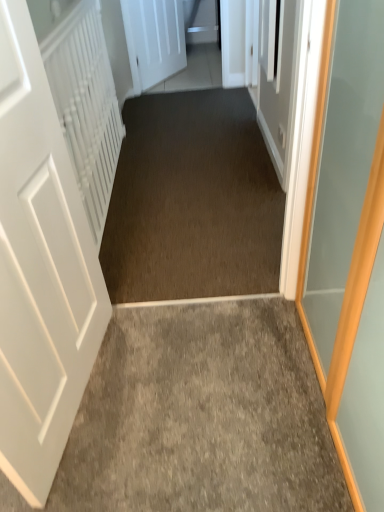
Locate an element on the screen. The width and height of the screenshot is (384, 512). white matte door at left, the first door from the front is located at coordinates (38, 270).

You are a GUI agent. You are given a task and a screenshot of the screen. Output one action in this format:
    pyautogui.click(x=<x>, y=<y>)
    Task: Click on the gray carpet at center
    
    Given the screenshot: What is the action you would take?
    pyautogui.click(x=202, y=416)

Considering the relative positions of white textured radiator at left and dark brown carpet at center in the image provided, is white textured radiator at left in front of dark brown carpet at center?

Yes, the depth of white textured radiator at left is less than that of dark brown carpet at center.

Is white textured radiator at left next to dark brown carpet at center and touching it?

No, white textured radiator at left is not beside dark brown carpet at center.

In order to click on corridor below the white textured radiator at left (from a real-world perspective) in this screenshot , I will do `click(192, 201)`.

Is white textured radiator at left wider or thinner than dark brown carpet at center?

Clearly, white textured radiator at left has less width compared to dark brown carpet at center.

From a real-world perspective, which is physically below, white matte door at left, the second door positioned from the back, or white matte door at upper center, which is the first door in back-to-front order?

white matte door at upper center, which is the first door in back-to-front order, from a real-world perspective.

Would you say white matte door at upper center, acting as the 2th door starting from the bottom, is part of white matte door at left, the 1th door in the bottom-to-top sequence,'s contents?

No, white matte door at upper center, acting as the 2th door starting from the bottom, is located outside of white matte door at left, the 1th door in the bottom-to-top sequence.

Identify the location of door below the white matte door at left, the second door positioned from the back (from a real-world perspective). This screenshot has height=512, width=384. (154, 40).

Which object is further away from the camera taking this photo, white matte door at left, the 1th door in the bottom-to-top sequence, or white matte door at upper center, acting as the 1th door starting from the top?

white matte door at upper center, acting as the 1th door starting from the top, is more distant.

This screenshot has height=512, width=384. In the image, there is a gray carpet at center. Identify the location of radiator above it (from the image's perspective). (86, 105).

From the image's perspective, would you say gray carpet at center is shown under white textured radiator at left?

Yes.

Considering the relative sizes of gray carpet at center and white textured radiator at left in the image provided, is gray carpet at center thinner than white textured radiator at left?

In fact, gray carpet at center might be wider than white textured radiator at left.

Is dark brown carpet at center taller or shorter than white matte door at left, the second door positioned from the back?

dark brown carpet at center is shorter than white matte door at left, the second door positioned from the back.

Is dark brown carpet at center outside of white matte door at left, the 1th door in the bottom-to-top sequence?

Yes.

Considering the sizes of dark brown carpet at center and white matte door at left, the second door positioned from the back, in the image, is dark brown carpet at center wider or thinner than white matte door at left, the second door positioned from the back,?

dark brown carpet at center is wider than white matte door at left, the second door positioned from the back.

Image resolution: width=384 pixels, height=512 pixels. Find the location of `door that is the 2nd one when counting leftward from the dark brown carpet at center`. door that is the 2nd one when counting leftward from the dark brown carpet at center is located at coordinates (38, 270).

Is white textured radiator at left positioned far away from gray carpet at center?

Indeed, white textured radiator at left is not near gray carpet at center.

Which of these two, white textured radiator at left or gray carpet at center, is smaller?

gray carpet at center is smaller.

Considering the positions of points (83, 159) and (252, 343), is point (83, 159) farther from camera compared to point (252, 343)?

Yes.

Which object is thinner, white textured radiator at left or gray carpet at center?

white textured radiator at left.

Is gray carpet at center not within white matte door at left, the first door from the front?

Yes, gray carpet at center is not within white matte door at left, the first door from the front.

You are a GUI agent. You are given a task and a screenshot of the screen. Output one action in this format:
    pyautogui.click(x=<x>, y=<y>)
    Task: Click on the path behind the white matte door at left, the first door from the front
    The height and width of the screenshot is (512, 384).
    Given the screenshot: What is the action you would take?
    pyautogui.click(x=202, y=416)

Based on their sizes in the image, would you say gray carpet at center is bigger or smaller than white matte door at left, which is the 2th door from top to bottom?

In the image, gray carpet at center appears to be smaller than white matte door at left, which is the 2th door from top to bottom.

In terms of height, does gray carpet at center look taller or shorter compared to white matte door at left, the second door positioned from the back?

Considering their sizes, gray carpet at center has less height than white matte door at left, the second door positioned from the back.

From the image's perspective, which door is the 2nd one above the gray carpet at center? Please provide its 2D coordinates.

[(154, 40)]

Between white matte door at upper center, acting as the 2th door starting from the bottom, and gray carpet at center, which one has less height?

gray carpet at center is shorter.

Considering the positions of objects white matte door at upper center, acting as the 1th door starting from the top, and gray carpet at center in the image provided, who is in front, white matte door at upper center, acting as the 1th door starting from the top, or gray carpet at center?

Positioned in front is gray carpet at center.

I want to click on radiator above the dark brown carpet at center (from a real-world perspective), so click(86, 105).

This screenshot has height=512, width=384. Identify the location of door behind the white matte door at left, the first door from the front. (154, 40).

Considering their positions, is white textured radiator at left positioned further to dark brown carpet at center than gray carpet at center?

gray carpet at center.

Looking at the image, which one is located closer to dark brown carpet at center, gray carpet at center or white matte door at upper center, which is the first door in back-to-front order?

gray carpet at center is closer to dark brown carpet at center.

Estimate the real-world distances between objects in this image. Which object is further from white matte door at upper center, which appears as the second door when viewed from the front, white matte door at left, the 1th door in the bottom-to-top sequence, or white textured radiator at left?

Among the two, white matte door at left, the 1th door in the bottom-to-top sequence, is located further to white matte door at upper center, which appears as the second door when viewed from the front.

From the image, which object appears to be nearer to white matte door at upper center, acting as the 2th door starting from the bottom, white matte door at left, the first door from the front, or gray carpet at center?

The object closer to white matte door at upper center, acting as the 2th door starting from the bottom, is white matte door at left, the first door from the front.

From the image, which object appears to be farther from white textured radiator at left, white matte door at left, which is the 2th door from top to bottom, or gray carpet at center?

The object further to white textured radiator at left is gray carpet at center.

Considering their positions, is gray carpet at center positioned further to white matte door at upper center, which appears as the second door when viewed from the front, than dark brown carpet at center?

Among the two, gray carpet at center is located further to white matte door at upper center, which appears as the second door when viewed from the front.

Considering their positions, is white matte door at left, which is the 2th door from top to bottom, positioned closer to dark brown carpet at center than white textured radiator at left?

Among the two, white textured radiator at left is located nearer to dark brown carpet at center.

Consider the image. Estimate the real-world distances between objects in this image. Which object is further from white matte door at upper center, acting as the 1th door starting from the top, dark brown carpet at center or white textured radiator at left?

white textured radiator at left is further to white matte door at upper center, acting as the 1th door starting from the top.

In order to click on door between white textured radiator at left and gray carpet at center vertically in this screenshot , I will do click(x=38, y=270).

Where is `radiator located between white matte door at left, which is the 2th door from top to bottom, and white matte door at upper center, acting as the 2th door starting from the bottom, in the depth direction`? This screenshot has height=512, width=384. radiator located between white matte door at left, which is the 2th door from top to bottom, and white matte door at upper center, acting as the 2th door starting from the bottom, in the depth direction is located at coordinates (86, 105).

What are the coordinates of `radiator positioned between white matte door at left, the second door positioned from the back, and dark brown carpet at center from near to far` in the screenshot? It's located at (86, 105).

Find the location of a particular element. This screenshot has height=512, width=384. corridor between white matte door at upper center, acting as the 2th door starting from the bottom, and gray carpet at center vertically is located at coordinates (192, 201).